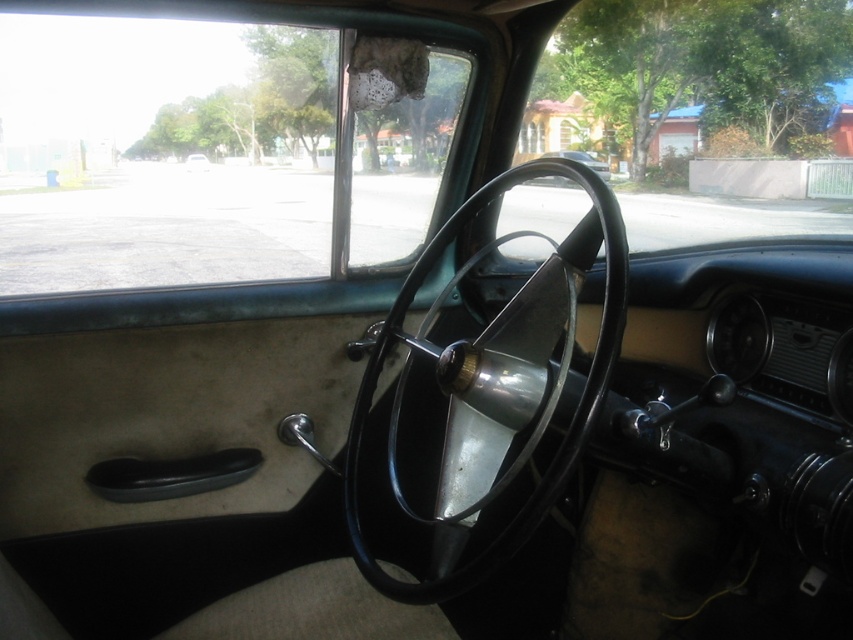
Is point (419, 280) farther from viewer compared to point (577, 161)?

That is True.

Does metallic silver steering wheel at center appear on the right side of metallic silver car at center?

In fact, metallic silver steering wheel at center is to the left of metallic silver car at center.

Locate an element on the screen. metallic silver steering wheel at center is located at coordinates (498, 387).

Identify the location of metallic silver steering wheel at center. This screenshot has width=853, height=640. (498, 387).

Between clear glass windshield at upper left and metallic silver car at center, which one appears on the right side from the viewer's perspective?

metallic silver car at center

Which of these two, clear glass windshield at upper left or metallic silver car at center, stands taller?

clear glass windshield at upper left

Describe the element at coordinates (161, 152) in the screenshot. I see `clear glass windshield at upper left` at that location.

Find the location of a particular element. Image resolution: width=853 pixels, height=640 pixels. clear glass windshield at upper left is located at coordinates (161, 152).

Can you confirm if metallic silver steering wheel at center is positioned to the left of matte black steering wheel at center?

Incorrect, metallic silver steering wheel at center is not on the left side of matte black steering wheel at center.

Describe the element at coordinates (498, 387) in the screenshot. I see `metallic silver steering wheel at center` at that location.

Between point (457, 406) and point (187, 157), which one is positioned in front?

Positioned in front is point (457, 406).

You are a GUI agent. You are given a task and a screenshot of the screen. Output one action in this format:
    pyautogui.click(x=<x>, y=<y>)
    Task: Click on the metallic silver steering wheel at center
    Image resolution: width=853 pixels, height=640 pixels.
    Given the screenshot: What is the action you would take?
    pyautogui.click(x=498, y=387)